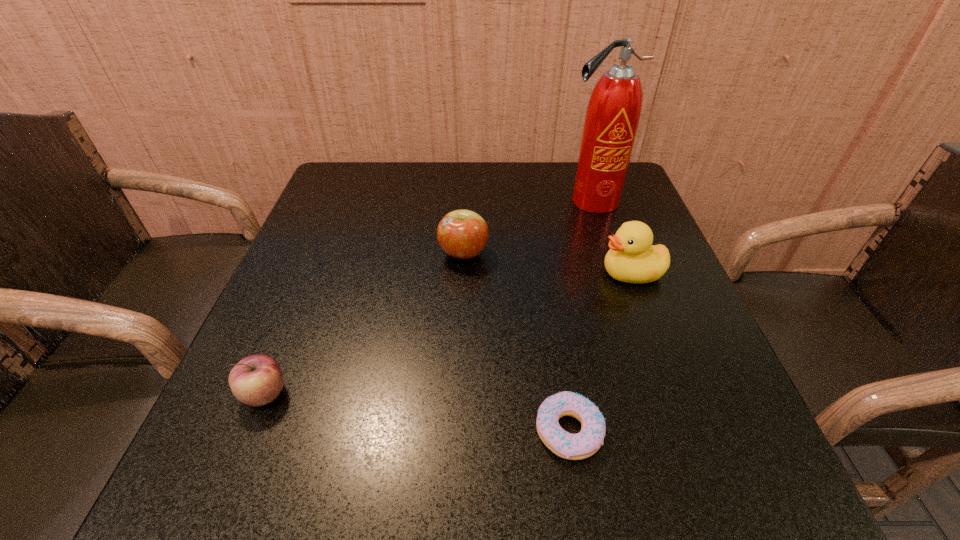
The height and width of the screenshot is (540, 960). In order to click on fire extinguisher in this screenshot , I will do `click(614, 109)`.

Locate an element on the screen. the tallest object is located at coordinates (614, 109).

Find the location of a particular element. the fourth shortest object is located at coordinates (632, 258).

Locate an element on the screen. The height and width of the screenshot is (540, 960). the fourth object from right to left is located at coordinates (463, 234).

Locate an element on the screen. The width and height of the screenshot is (960, 540). the right apple is located at coordinates (463, 234).

Locate an element on the screen. Image resolution: width=960 pixels, height=540 pixels. the left apple is located at coordinates (256, 380).

At what (x,y) coordinates should I click in order to perform the action: click on the nearer apple. Please return your answer as a coordinate pair (x, y). This screenshot has height=540, width=960. Looking at the image, I should click on (256, 380).

At what (x,y) coordinates should I click in order to perform the action: click on the third object from right to left. Please return your answer as a coordinate pair (x, y). The height and width of the screenshot is (540, 960). Looking at the image, I should click on (587, 442).

The width and height of the screenshot is (960, 540). Identify the location of doughnut. (587, 442).

What are the coordinates of `free space located on the left of the farthest object` in the screenshot? It's located at (478, 201).